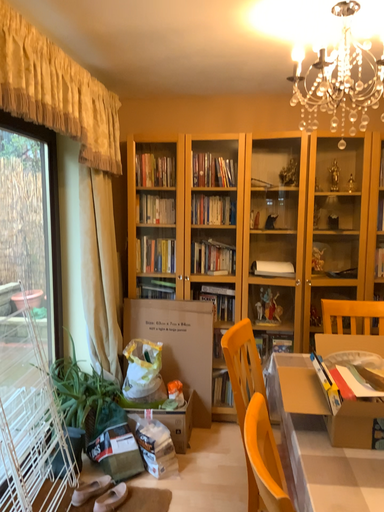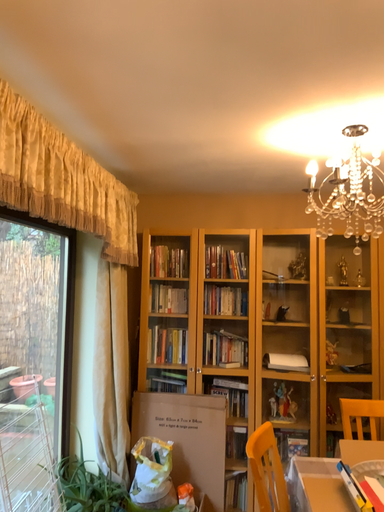
Question: Which way did the camera rotate in the video?

Choices:
 (A) rotated downward
 (B) rotated upward

Answer: (B)